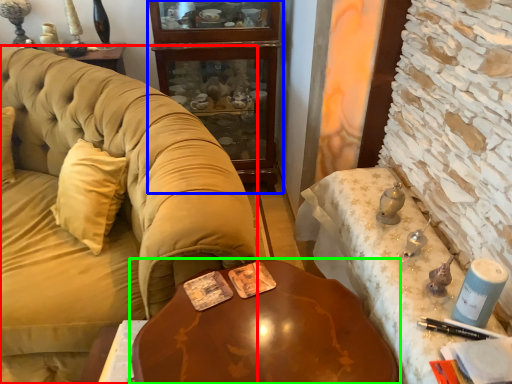
Question: Based on their relative distances, which object is farther from studio couch (highlighted by a red box)? Choose from cabinetry (highlighted by a blue box) and table (highlighted by a green box).

Choices:
 (A) cabinetry
 (B) table

Answer: (A)